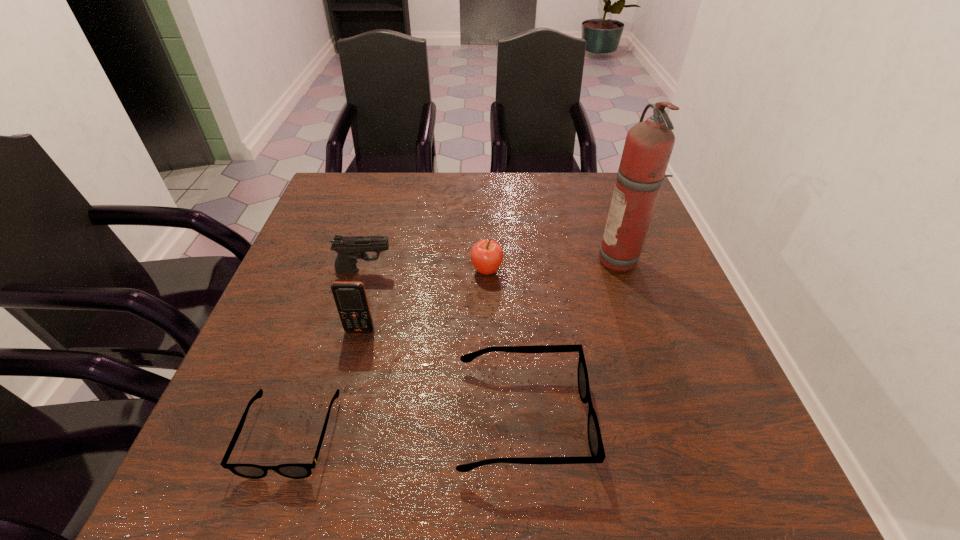
Identify the location of vacant space that's between the fifth tallest object and the pistol. (444, 345).

Where is `free space that is in between the shortest object and the taller spectacles`? The image size is (960, 540). free space that is in between the shortest object and the taller spectacles is located at coordinates (407, 427).

At what (x,y) coordinates should I click in order to perform the action: click on free area in between the right spectacles and the apple. Please return your answer as a coordinate pair (x, y). This screenshot has width=960, height=540. Looking at the image, I should click on (504, 345).

What are the coordinates of `the third closest object to the fire extinguisher` in the screenshot? It's located at (349, 248).

Find the location of a particular element. the fourth closest object to the fifth tallest object is located at coordinates (648, 146).

The width and height of the screenshot is (960, 540). What are the coordinates of `vacant area that satisfies the following two spatial constraints: 1. at the barrel of the pistol; 2. on the arms of the shortest object` in the screenshot? It's located at (318, 435).

Find the location of a particular element. Image resolution: width=960 pixels, height=540 pixels. free location that satisfies the following two spatial constraints: 1. on the side of the tallest object with the label and nozzle; 2. on the arms of the shortest object is located at coordinates (684, 435).

The width and height of the screenshot is (960, 540). Identify the location of vacant area in the image that satisfies the following two spatial constraints: 1. at the barrel of the apple; 2. on the right side of the pistol. (365, 271).

The image size is (960, 540). I want to click on free point that satisfies the following two spatial constraints: 1. on the arms of the fifth tallest object; 2. on the arms of the shorter spectacles, so click(523, 435).

Identify the location of blank area in the image that satisfies the following two spatial constraints: 1. on the back side of the apple; 2. at the barrel of the pistol. (487, 271).